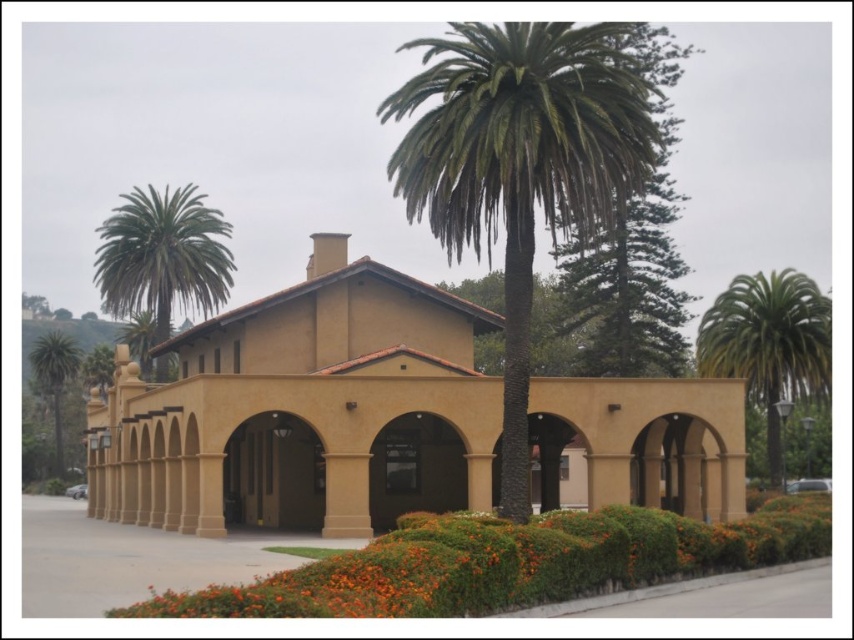
Question: Considering the real-world distances, which object is farthest from the green leafy palm tree at right?

Choices:
 (A) green leafy palm tree at upper center
 (B) green leafy palm tree at upper left
 (C) green leafy palm tree at center

Answer: (A)

Question: Which object is the closest to the green leafy palm tree at left?

Choices:
 (A) green leafy palm tree at right
 (B) green leafy palm tree at upper left

Answer: (B)

Question: Can you confirm if green leafy palm tree at right is wider than green leafy palm tree at upper center?

Choices:
 (A) no
 (B) yes

Answer: (B)

Question: Which object is positioned closest to the green leafy palm tree at right?

Choices:
 (A) green leafy palm tree at upper left
 (B) green leafy palm tree at center

Answer: (B)

Question: Is green leafy palm tree at center below green leafy palm tree at right?

Choices:
 (A) no
 (B) yes

Answer: (A)

Question: Does green leafy palm tree at left appear over green leafy palm tree at upper center?

Choices:
 (A) yes
 (B) no

Answer: (B)